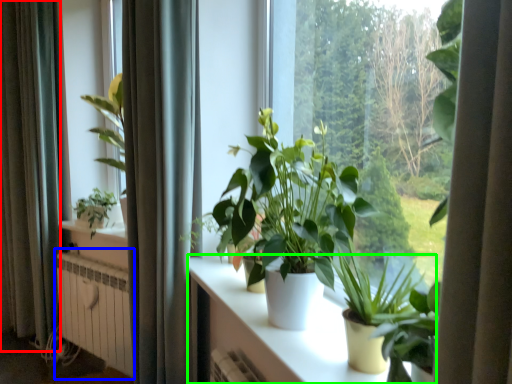
Question: Estimate the real-world distances between objects in this image. Which object is closer to curtain (highlighted by a red box), radiator (highlighted by a blue box) or table (highlighted by a green box)?

Choices:
 (A) radiator
 (B) table

Answer: (A)